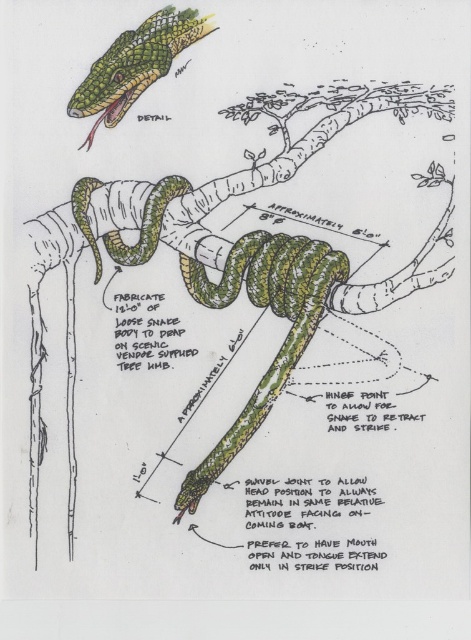
Looking at this image, who is more forward, [291,356] or [149,36]?

Point [149,36] is more forward.

Is green scaly snake at center to the right of green scaly snake at upper left from the viewer's perspective?

Correct, you'll find green scaly snake at center to the right of green scaly snake at upper left.

Where is `green scaly snake at center`? green scaly snake at center is located at coordinates (273, 312).

Locate an element on the screen. This screenshot has height=640, width=471. green scaly snake at center is located at coordinates (273, 312).